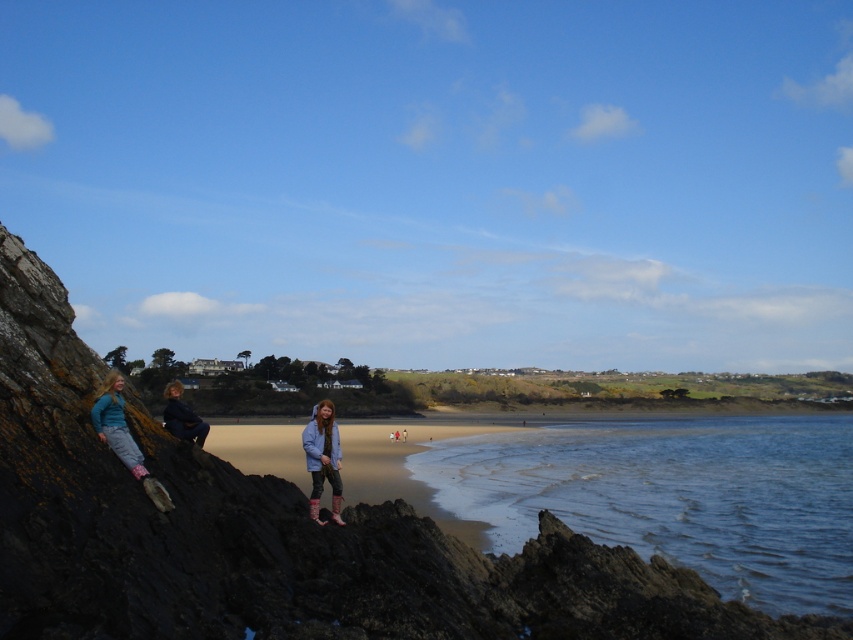
Question: Estimate the real-world distances between objects in this image. Which object is closer to the matte black jacket at left?

Choices:
 (A) brown sandy beach at center
 (B) matte blue jacket at center

Answer: (B)

Question: Is blue water at lower right above matte black jacket at left?

Choices:
 (A) yes
 (B) no

Answer: (B)

Question: Which point appears farthest from the camera in this image?

Choices:
 (A) (177, 420)
 (B) (311, 518)

Answer: (A)

Question: Does blue water at lower right have a lesser width compared to matte blue jacket at center?

Choices:
 (A) no
 (B) yes

Answer: (A)

Question: Does blue water at lower right have a smaller size compared to brown sandy beach at center?

Choices:
 (A) no
 (B) yes

Answer: (A)

Question: Which of the following is the farthest from the observer?

Choices:
 (A) (743, 568)
 (B) (346, 504)

Answer: (B)